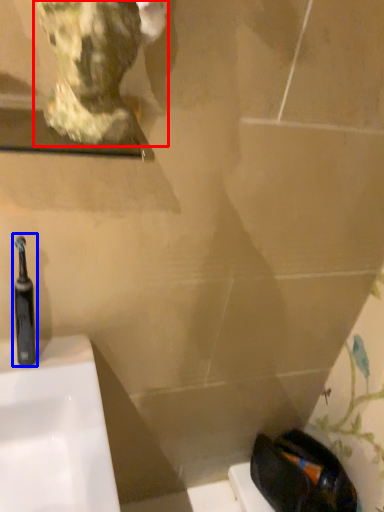
Question: Which object appears farthest to the camera in this image, sculpture (highlighted by a red box) or toothbrush (highlighted by a blue box)?

Choices:
 (A) sculpture
 (B) toothbrush

Answer: (B)